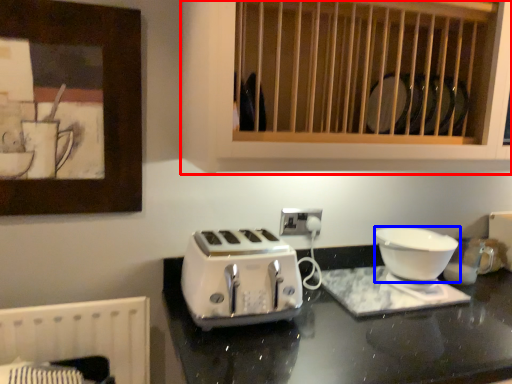
Question: Which object appears closest to the camera in this image, cabinetry (highlighted by a red box) or kitchen appliance (highlighted by a blue box)?

Choices:
 (A) cabinetry
 (B) kitchen appliance

Answer: (A)